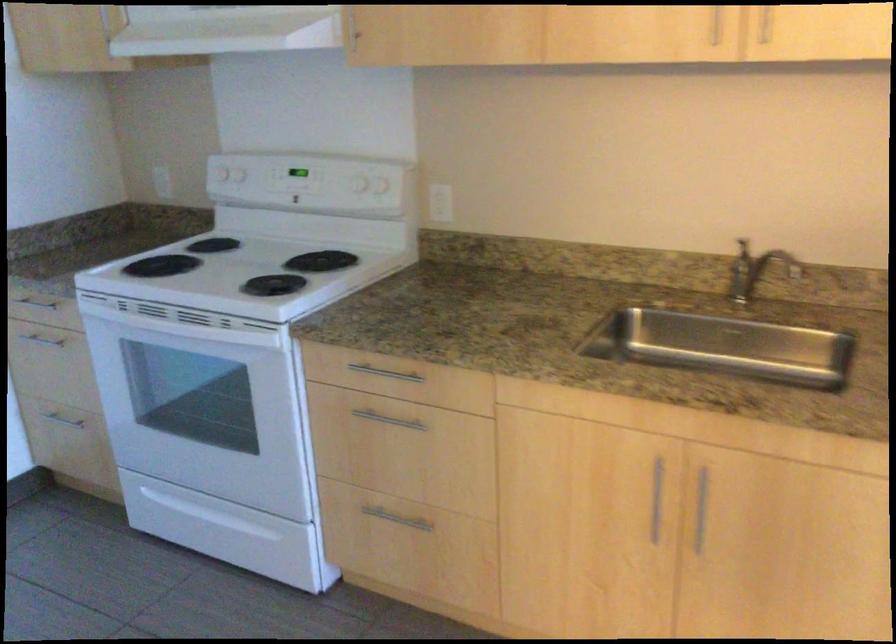
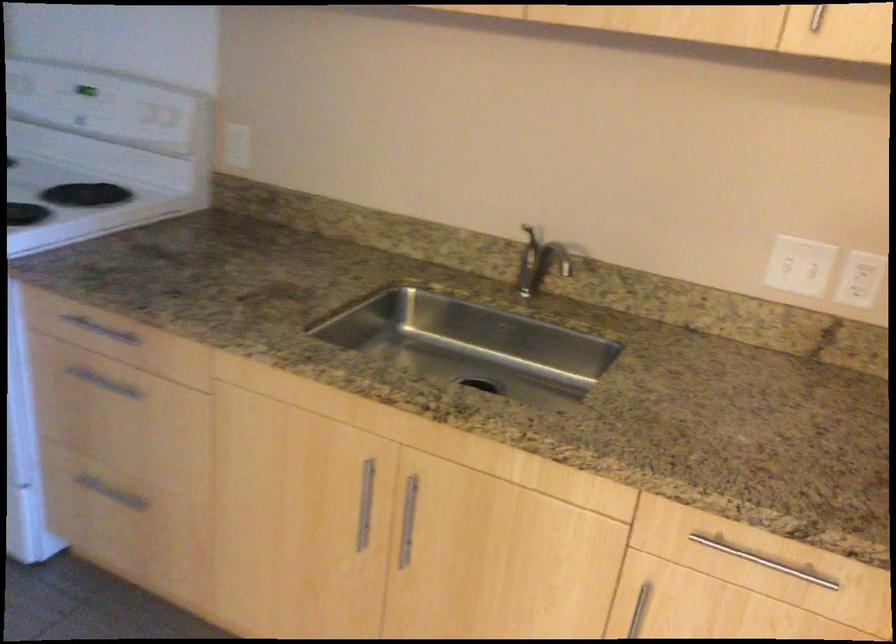
Question: I am providing you with two images of the same scene from different viewpoints. Which of the following objects are not visible in image2?

Choices:
 (A) metal cabinet handle
 (B) metal bar handle
 (C) white rocker switch
 (D) none of these

Answer: (D)